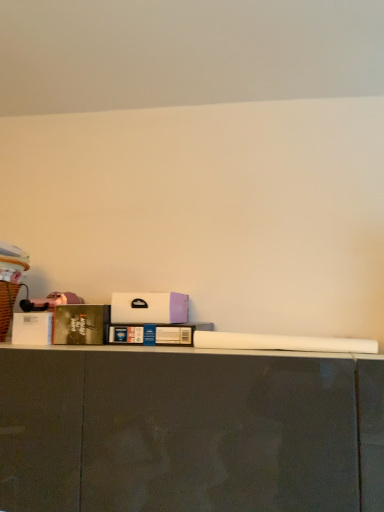
In order to click on blue cardboard book at center, which is counted as the second book, starting from the left in this screenshot , I will do `click(157, 333)`.

The height and width of the screenshot is (512, 384). What do you see at coordinates (10, 283) in the screenshot?
I see `brown wicker laundry basket at left` at bounding box center [10, 283].

What do you see at coordinates (149, 307) in the screenshot? I see `white matte box at center` at bounding box center [149, 307].

This screenshot has height=512, width=384. I want to click on blue cardboard book at center, which is counted as the second book, starting from the left, so click(157, 333).

Looking at this image, between blue cardboard book at center, which appears as the 1th book when viewed from the right, and brown wicker laundry basket at left, which one has more height?

Standing taller between the two is brown wicker laundry basket at left.

Is blue cardboard book at center, which appears as the 1th book when viewed from the right, to the left of brown wicker laundry basket at left from the viewer's perspective?

In fact, blue cardboard book at center, which appears as the 1th book when viewed from the right, is to the right of brown wicker laundry basket at left.

Does point (187, 330) come in front of point (12, 298)?

Yes, it is in front of point (12, 298).

Can you confirm if brown wicker laundry basket at left is wider than blue cardboard book at center, which appears as the 1th book when viewed from the right?

No.

Which is nearer, (x=8, y=316) or (x=190, y=342)?

Point (x=8, y=316) is farther from the camera than point (x=190, y=342).

Is brown wicker laundry basket at left positioned beyond the bounds of blue cardboard book at center, which appears as the 1th book when viewed from the right?

Yes, brown wicker laundry basket at left is located beyond the bounds of blue cardboard book at center, which appears as the 1th book when viewed from the right.

From the image's perspective, which object appears higher, blue cardboard book at center, which is counted as the second book, starting from the left, or white matte box at center?

From the image's view, white matte box at center is above.

Considering the sizes of objects blue cardboard book at center, which appears as the 1th book when viewed from the right, and white matte box at center in the image provided, who is shorter, blue cardboard book at center, which appears as the 1th book when viewed from the right, or white matte box at center?

With less height is blue cardboard book at center, which appears as the 1th book when viewed from the right.

Considering the sizes of objects blue cardboard book at center, which is counted as the second book, starting from the left, and white matte box at center in the image provided, who is bigger, blue cardboard book at center, which is counted as the second book, starting from the left, or white matte box at center?

blue cardboard book at center, which is counted as the second book, starting from the left, is bigger.

Measure the distance from blue cardboard book at center, which is counted as the second book, starting from the left, to white matte box at center.

blue cardboard book at center, which is counted as the second book, starting from the left, is 1.91 inches from white matte box at center.

The width and height of the screenshot is (384, 512). I want to click on box above the hardcover book at left, the 2th book in the right-to-left sequence (from the image's perspective), so click(149, 307).

Considering the positions of objects white matte box at center and hardcover book at left, the 2th book in the right-to-left sequence, in the image provided, who is more to the left, white matte box at center or hardcover book at left, the 2th book in the right-to-left sequence,?

hardcover book at left, the 2th book in the right-to-left sequence, is more to the left.

From a real-world perspective, is white matte box at center physically located above or below hardcover book at left, the 2th book in the right-to-left sequence?

From a real-world perspective, white matte box at center is physically above hardcover book at left, the 2th book in the right-to-left sequence.

Is white matte box at center positioned behind hardcover book at left, the 2th book in the right-to-left sequence?

No, the depth of white matte box at center is less than that of hardcover book at left, the 2th book in the right-to-left sequence.

Considering the relative positions of white matte box at center and brown wicker laundry basket at left in the image provided, is white matte box at center to the right of brown wicker laundry basket at left from the viewer's perspective?

Correct, you'll find white matte box at center to the right of brown wicker laundry basket at left.

Does white matte box at center have a smaller size compared to brown wicker laundry basket at left?

Indeed, white matte box at center has a smaller size compared to brown wicker laundry basket at left.

The image size is (384, 512). Identify the location of laundry basket located above the white matte box at center (from the image's perspective). (10, 283).

Does hardcover book at left, the 2th book in the right-to-left sequence, have a lesser width compared to brown wicker laundry basket at left?

Yes.

Can you confirm if hardcover book at left, the 1th book in the left-to-right sequence, is shorter than brown wicker laundry basket at left?

Indeed, hardcover book at left, the 1th book in the left-to-right sequence, has a lesser height compared to brown wicker laundry basket at left.

Are hardcover book at left, the 1th book in the left-to-right sequence, and brown wicker laundry basket at left far apart?

No, there isn't a large distance between hardcover book at left, the 1th book in the left-to-right sequence, and brown wicker laundry basket at left.

Considering their positions, is hardcover book at left, the 1th book in the left-to-right sequence, located in front of or behind brown wicker laundry basket at left?

Visually, hardcover book at left, the 1th book in the left-to-right sequence, is located behind brown wicker laundry basket at left.

Is hardcover book at left, the 2th book in the right-to-left sequence, inside or outside of white matte box at center?

hardcover book at left, the 2th book in the right-to-left sequence, lies outside white matte box at center.

Is hardcover book at left, the 2th book in the right-to-left sequence, oriented towards white matte box at center?

No, hardcover book at left, the 2th book in the right-to-left sequence, is not oriented towards white matte box at center.

Which of these two, hardcover book at left, the 1th book in the left-to-right sequence, or white matte box at center, is smaller?

hardcover book at left, the 1th book in the left-to-right sequence, is smaller.

Which object is thinner, hardcover book at left, the 1th book in the left-to-right sequence, or white matte box at center?

With smaller width is hardcover book at left, the 1th book in the left-to-right sequence.

Which book is the 1st one when counting from the back of the brown wicker laundry basket at left? Please provide its 2D coordinates.

[(157, 333)]

Locate an element on the screen. This screenshot has height=512, width=384. laundry basket above the blue cardboard book at center, which appears as the 1th book when viewed from the right (from the image's perspective) is located at coordinates [10, 283].

Which object lies nearer to the anchor point blue cardboard book at center, which appears as the 1th book when viewed from the right, brown wicker laundry basket at left or hardcover book at left, the 1th book in the left-to-right sequence?

hardcover book at left, the 1th book in the left-to-right sequence, lies closer to blue cardboard book at center, which appears as the 1th book when viewed from the right, than the other object.

From the picture: When comparing their distances from white matte box at center, does blue cardboard book at center, which is counted as the second book, starting from the left, or brown wicker laundry basket at left seem further?

The object further to white matte box at center is brown wicker laundry basket at left.

Looking at the image, which one is located closer to brown wicker laundry basket at left, hardcover book at left, the 1th book in the left-to-right sequence, or white matte box at center?

hardcover book at left, the 1th book in the left-to-right sequence.

Based on their spatial positions, is white matte box at center or hardcover book at left, the 2th book in the right-to-left sequence, closer to brown wicker laundry basket at left?

hardcover book at left, the 2th book in the right-to-left sequence.

Estimate the real-world distances between objects in this image. Which object is further from hardcover book at left, the 2th book in the right-to-left sequence, blue cardboard book at center, which is counted as the second book, starting from the left, or white matte box at center?

blue cardboard book at center, which is counted as the second book, starting from the left, is positioned further to the anchor hardcover book at left, the 2th book in the right-to-left sequence.

Based on their spatial positions, is hardcover book at left, the 1th book in the left-to-right sequence, or blue cardboard book at center, which is counted as the second book, starting from the left, further from white matte box at center?

hardcover book at left, the 1th book in the left-to-right sequence, lies further to white matte box at center than the other object.

Based on their spatial positions, is brown wicker laundry basket at left or white matte box at center closer to hardcover book at left, the 1th book in the left-to-right sequence?

white matte box at center is closer to hardcover book at left, the 1th book in the left-to-right sequence.

Considering their positions, is hardcover book at left, the 2th book in the right-to-left sequence, positioned further to brown wicker laundry basket at left than blue cardboard book at center, which appears as the 1th book when viewed from the right?

blue cardboard book at center, which appears as the 1th book when viewed from the right.

At what (x,y) coordinates should I click in order to perform the action: click on box located between brown wicker laundry basket at left and blue cardboard book at center, which appears as the 1th book when viewed from the right, in the left-right direction. Please return your answer as a coordinate pair (x, y). Image resolution: width=384 pixels, height=512 pixels. Looking at the image, I should click on (149, 307).

The height and width of the screenshot is (512, 384). What are the coordinates of `book between brown wicker laundry basket at left and blue cardboard book at center, which is counted as the second book, starting from the left` in the screenshot? It's located at (81, 324).

Find the location of a particular element. The height and width of the screenshot is (512, 384). book between brown wicker laundry basket at left and white matte box at center in the horizontal direction is located at coordinates (81, 324).

The image size is (384, 512). What are the coordinates of `box between hardcover book at left, the 1th book in the left-to-right sequence, and blue cardboard book at center, which is counted as the second book, starting from the left` in the screenshot? It's located at pyautogui.click(x=149, y=307).